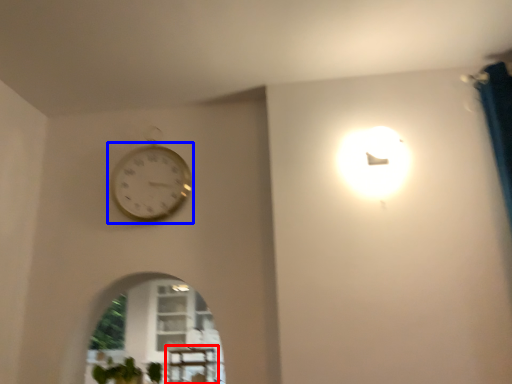
Question: Which of the following is the farthest to the observer, table (highlighted by a red box) or wall clock (highlighted by a blue box)?

Choices:
 (A) table
 (B) wall clock

Answer: (B)